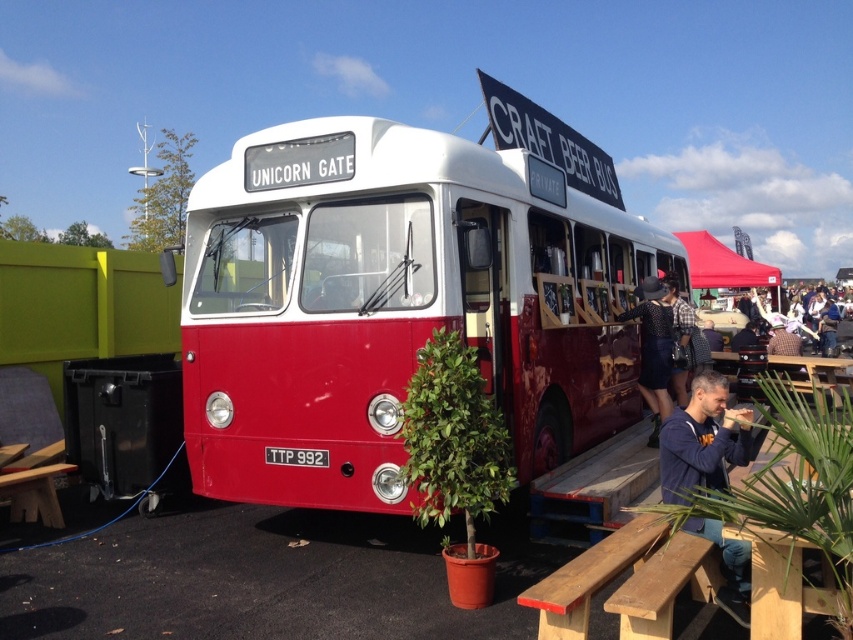
Looking at this image, you are a photographer planning to take a photo of the blue cotton shirt at lower right and the black dotted dress at center. Which item should you focus on first if you want to capture both in sharp focus without moving the camera?

The blue cotton shirt at lower right is in front of the black dotted dress at center, so you should focus on the blue cotton shirt at lower right first to ensure both are in focus.